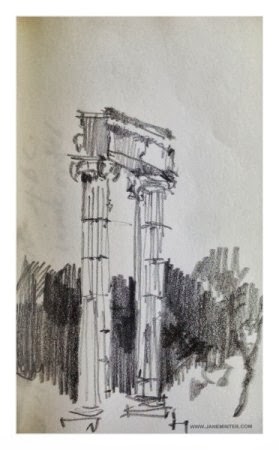
The width and height of the screenshot is (279, 450). Find the location of `pillar`. pillar is located at coordinates (95, 345), (147, 347).